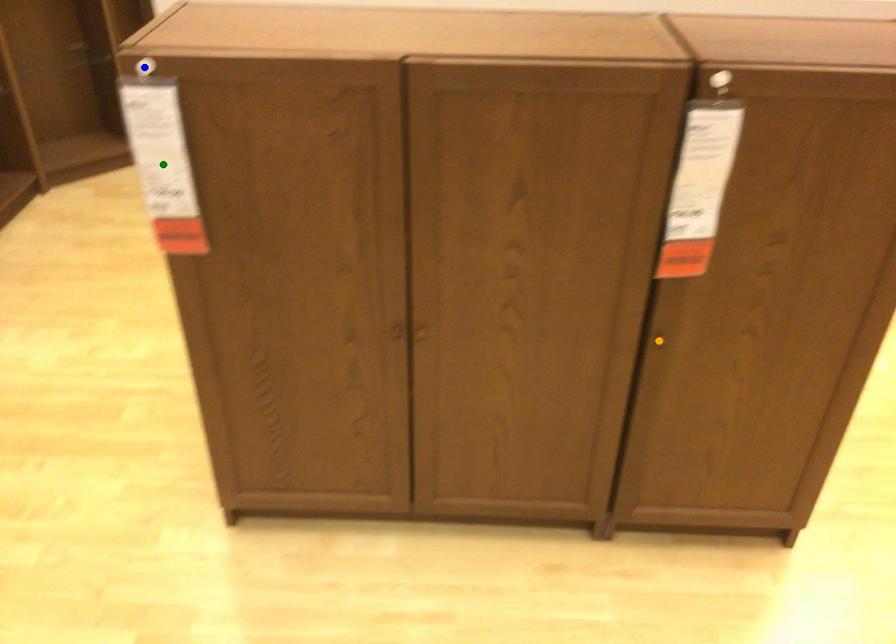
Order these from nearest to farthest:
blue point
green point
orange point

blue point, green point, orange point